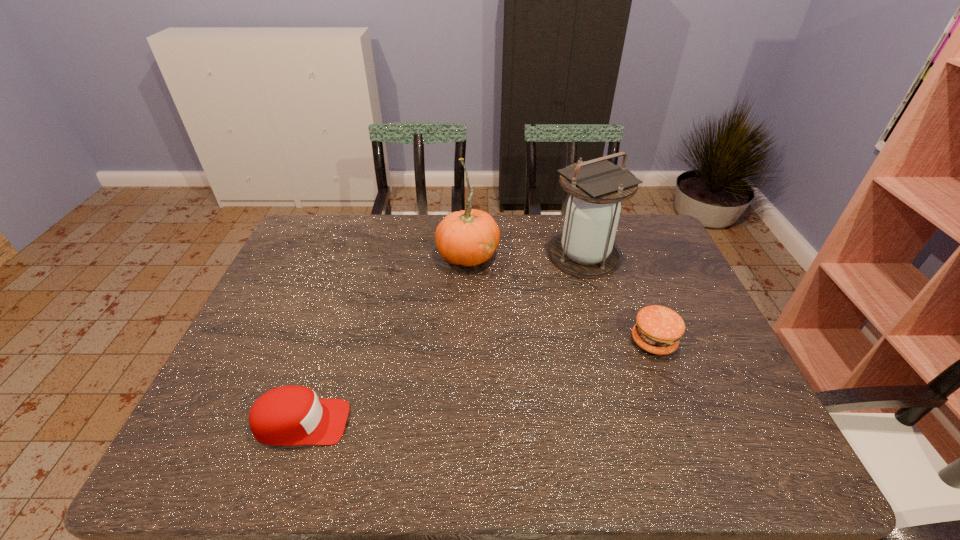
I want to click on the tallest object, so click(597, 187).

Image resolution: width=960 pixels, height=540 pixels. I want to click on the second object from left to right, so click(x=468, y=238).

At what (x,y) coordinates should I click in order to perform the action: click on the third shortest object. Please return your answer as a coordinate pair (x, y). The image size is (960, 540). Looking at the image, I should click on [468, 238].

Image resolution: width=960 pixels, height=540 pixels. What are the coordinates of `the second nearest object` in the screenshot? It's located at (657, 330).

At what (x,y) coordinates should I click in order to perform the action: click on the leftmost object. Please return your answer as a coordinate pair (x, y). This screenshot has height=540, width=960. Looking at the image, I should click on (289, 415).

This screenshot has width=960, height=540. I want to click on the nearest object, so click(289, 415).

Locate an element on the screen. Image resolution: width=960 pixels, height=540 pixels. free space located 0.150m on the left of the tallest object is located at coordinates (502, 257).

The width and height of the screenshot is (960, 540). I want to click on vacant position located 0.130m on the right of the second tallest object, so click(540, 254).

This screenshot has height=540, width=960. Find the location of `vacant space located 0.050m on the right of the patty`. vacant space located 0.050m on the right of the patty is located at coordinates (695, 342).

Where is `vacant point located 0.270m on the front-facing side of the leftmost object`? The image size is (960, 540). vacant point located 0.270m on the front-facing side of the leftmost object is located at coordinates (470, 422).